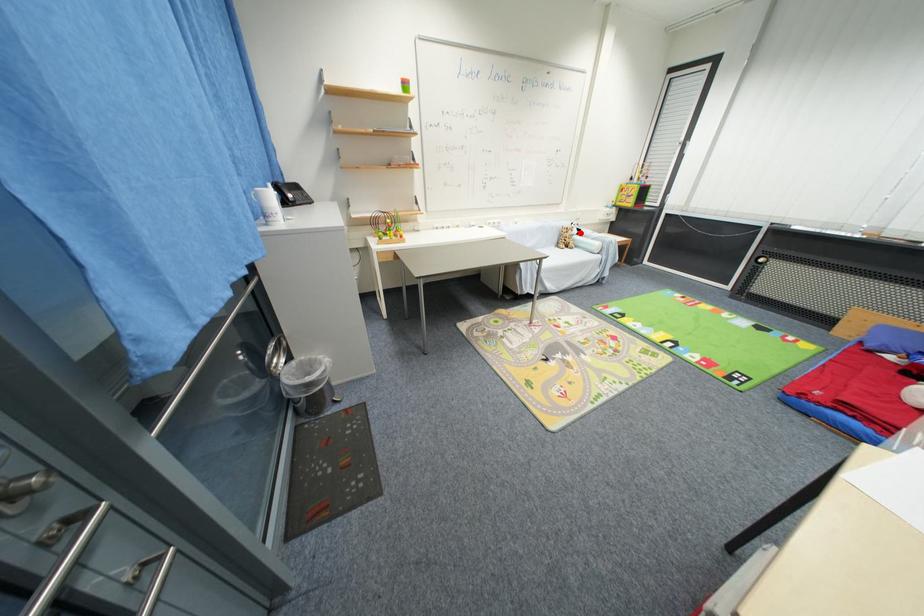
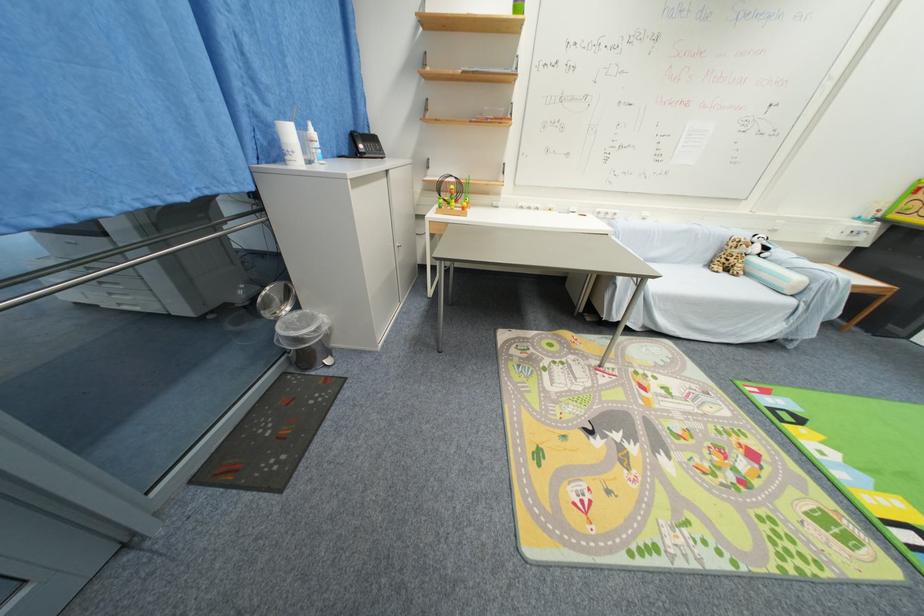
In the second image, find the point that corresponds to the highlighted location in the first image.

(761, 251)